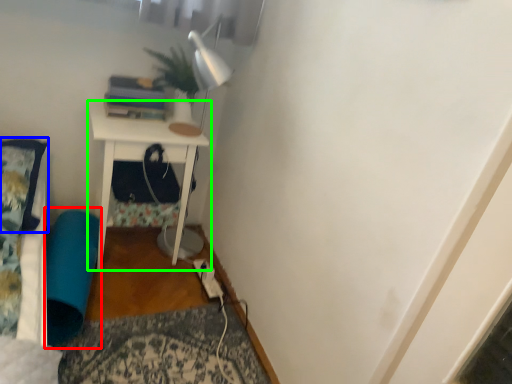
Question: Estimate the real-world distances between objects in this image. Which object is farther from bean bag chair (highlighted by a red box), pillow (highlighted by a blue box) or nightstand (highlighted by a green box)?

Choices:
 (A) pillow
 (B) nightstand

Answer: (A)